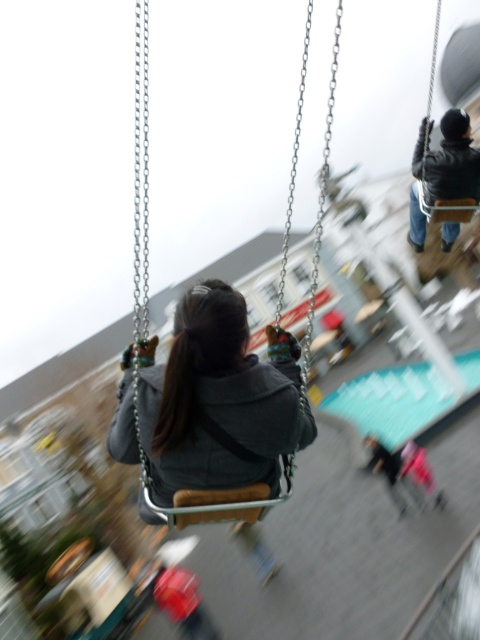
Question: From the image, what is the correct spatial relationship of dark gray hoodie at center in relation to wooden swing at center?

Choices:
 (A) right
 (B) left

Answer: (B)

Question: Which is farther from the wooden swing at center?

Choices:
 (A) dark gray hoodie at center
 (B) dark gray jacket at upper right

Answer: (B)

Question: Which of these objects is positioned farthest from the dark gray hoodie at center?

Choices:
 (A) wooden swing at center
 (B) dark gray jacket at upper right

Answer: (B)

Question: Which object is positioned farthest from the dark gray hoodie at center?

Choices:
 (A) dark gray jacket at upper right
 (B) wooden swing at center

Answer: (A)

Question: Does wooden swing at center appear over dark gray jacket at upper right?

Choices:
 (A) no
 (B) yes

Answer: (B)

Question: Considering the relative positions of wooden swing at center and dark gray jacket at upper right in the image provided, where is wooden swing at center located with respect to dark gray jacket at upper right?

Choices:
 (A) right
 (B) left

Answer: (A)